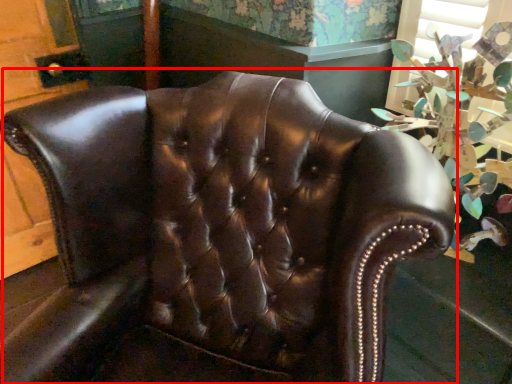
Question: From the image's perspective, what is the correct spatial positioning of chair (annotated by the red box) in reference to floral arrangement?

Choices:
 (A) below
 (B) above

Answer: (A)